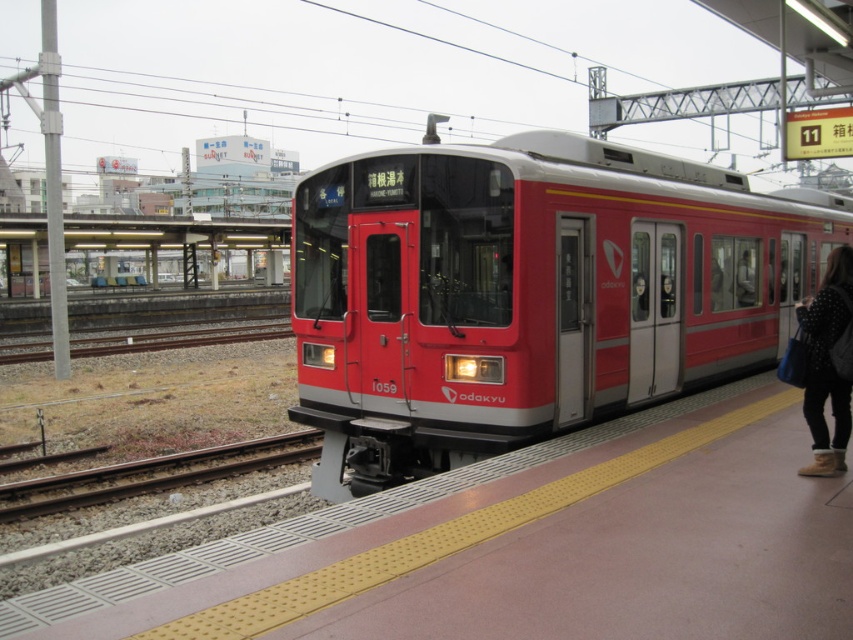
Question: Does matte red train at center appear under leather jacket at right?

Choices:
 (A) yes
 (B) no

Answer: (B)

Question: Among these objects, which one is nearest to the camera?

Choices:
 (A) gravel railway track at lower left
 (B) matte red train at center
 (C) leather jacket at right

Answer: (C)

Question: Estimate the real-world distances between objects in this image. Which object is closer to the leather jacket at right?

Choices:
 (A) matte red train at center
 (B) gravel at track left
 (C) gravel railway track at lower left

Answer: (A)

Question: Is matte red train at center behind gravel at track left?

Choices:
 (A) yes
 (B) no

Answer: (B)

Question: Is matte red train at center positioned behind gravel at track left?

Choices:
 (A) no
 (B) yes

Answer: (A)

Question: Which is nearer to the gravel railway track at lower left?

Choices:
 (A) matte red train at center
 (B) gravel at track left
 (C) leather jacket at right

Answer: (A)